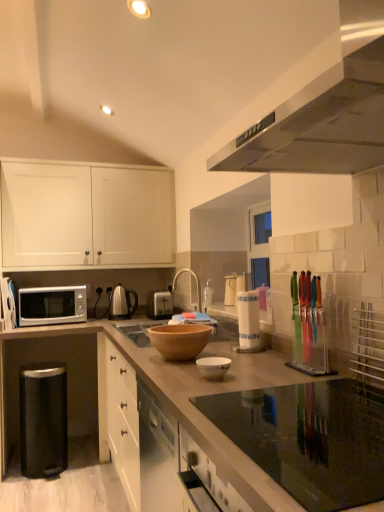
Question: From a real-world perspective, is white paper towel holder at center, which is the 3th appliance from back to front, below satin nickel tea kettle at center?

Choices:
 (A) yes
 (B) no

Answer: (B)

Question: Does white paper towel holder at center, which is the 3th appliance from back to front, have a lesser width compared to satin nickel tea kettle at center?

Choices:
 (A) yes
 (B) no

Answer: (B)

Question: Is white paper towel holder at center, the third appliance in the front-to-back sequence, shorter than satin nickel tea kettle at center?

Choices:
 (A) yes
 (B) no

Answer: (A)

Question: From the image's perspective, is white paper towel holder at center, arranged as the 3th appliance when viewed from the right, over satin nickel tea kettle at center?

Choices:
 (A) yes
 (B) no

Answer: (A)

Question: Is white paper towel holder at center, the 3th appliance in the left-to-right sequence, wider than satin nickel tea kettle at center?

Choices:
 (A) yes
 (B) no

Answer: (A)

Question: Is white paper towel holder at center, the 3th appliance in the left-to-right sequence, to the left of satin nickel tea kettle at center from the viewer's perspective?

Choices:
 (A) no
 (B) yes

Answer: (A)

Question: Does satin nickel tea kettle at center have a lesser width compared to white paper towel holder at center, which is the 3th appliance from back to front?

Choices:
 (A) no
 (B) yes

Answer: (B)

Question: Does satin nickel tea kettle at center come in front of white paper towel holder at center, the 3th appliance in the left-to-right sequence?

Choices:
 (A) yes
 (B) no

Answer: (B)

Question: Considering the relative sizes of satin nickel tea kettle at center and white paper towel holder at center, arranged as the 3th appliance when viewed from the right, in the image provided, is satin nickel tea kettle at center smaller than white paper towel holder at center, arranged as the 3th appliance when viewed from the right,?

Choices:
 (A) yes
 (B) no

Answer: (B)

Question: Can you confirm if satin nickel tea kettle at center is wider than white paper towel holder at center, the third appliance in the front-to-back sequence?

Choices:
 (A) yes
 (B) no

Answer: (B)

Question: Can you see satin nickel tea kettle at center touching white paper towel holder at center, the third appliance in the front-to-back sequence?

Choices:
 (A) no
 (B) yes

Answer: (A)

Question: Is satin nickel tea kettle at center positioned with its back to white paper towel holder at center, arranged as the 3th appliance when viewed from the right?

Choices:
 (A) yes
 (B) no

Answer: (B)

Question: Is silver metallic toaster at center, the second appliance in the left-to-right sequence, shorter than white glossy bowl at center?

Choices:
 (A) no
 (B) yes

Answer: (A)